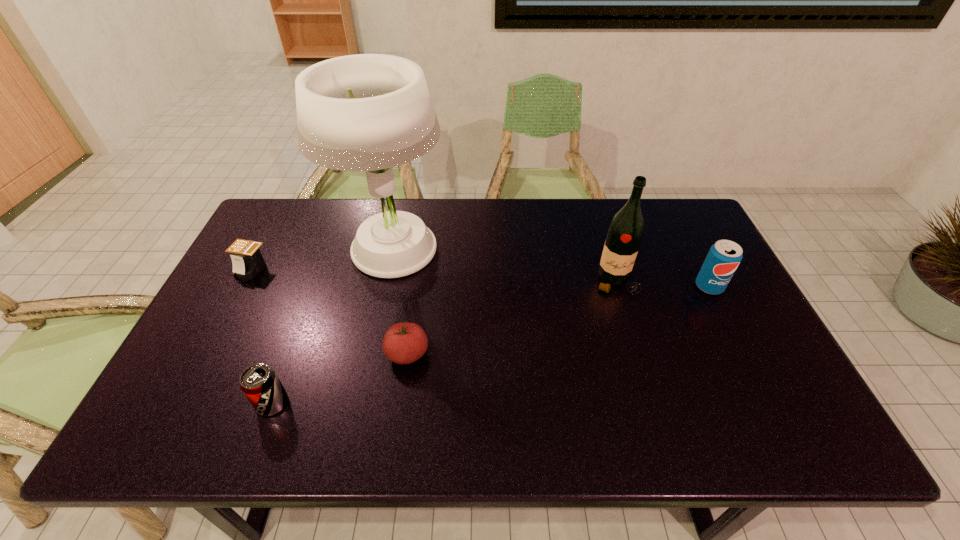
Where is `free space located on the front-facing side of the tallest object`? The width and height of the screenshot is (960, 540). free space located on the front-facing side of the tallest object is located at coordinates (370, 356).

Locate an element on the screen. Image resolution: width=960 pixels, height=540 pixels. vacant space located on the surface of the wine bottle is located at coordinates tap(631, 328).

Locate an element on the screen. The height and width of the screenshot is (540, 960). vacant area located 0.060m on the front of the rightmost object is located at coordinates (722, 313).

The width and height of the screenshot is (960, 540). What are the coordinates of `vacant space located on the right of the nearer soda can` in the screenshot? It's located at (444, 403).

Find the location of `vacant region located on the right of the second nearest object`. vacant region located on the right of the second nearest object is located at coordinates (528, 354).

The image size is (960, 540). Identify the location of free spot located on the right of the calculator. (296, 269).

The width and height of the screenshot is (960, 540). In order to click on object positioned at the far edge in this screenshot , I will do pos(366,112).

The width and height of the screenshot is (960, 540). In order to click on object situated at the near edge in this screenshot , I will do `click(259, 382)`.

Locate an element on the screen. The height and width of the screenshot is (540, 960). object present at the left edge is located at coordinates (247, 259).

Locate an element on the screen. Image resolution: width=960 pixels, height=540 pixels. object that is at the right edge is located at coordinates (723, 258).